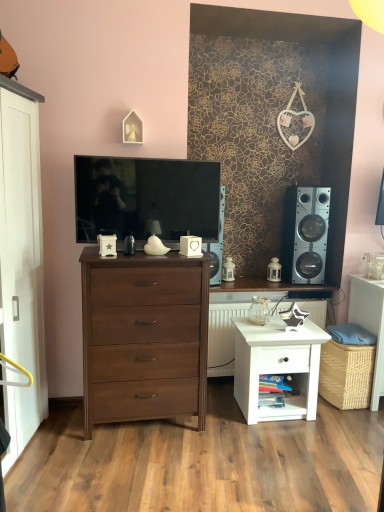
In order to click on free space in front of white glossy nightstand at lower right in this screenshot , I will do `click(288, 441)`.